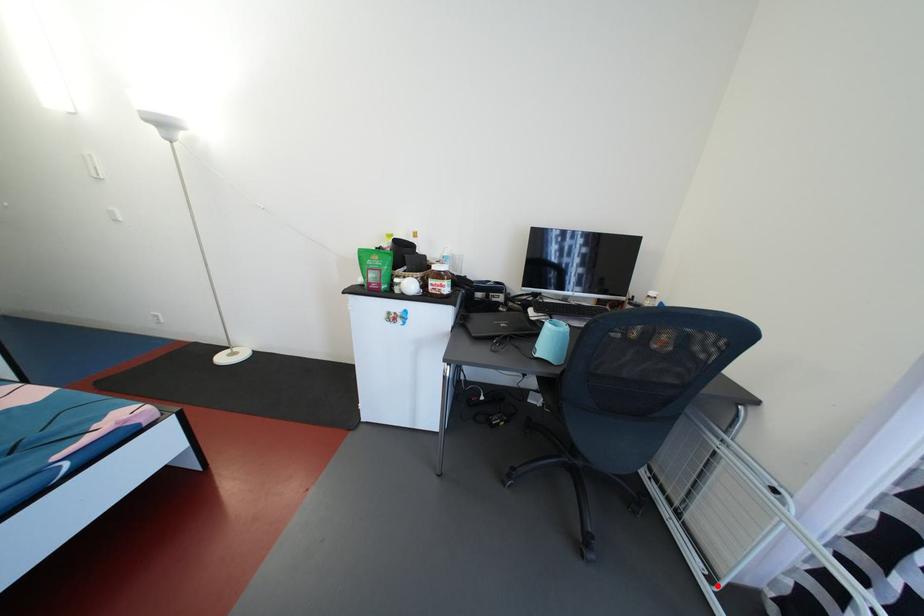
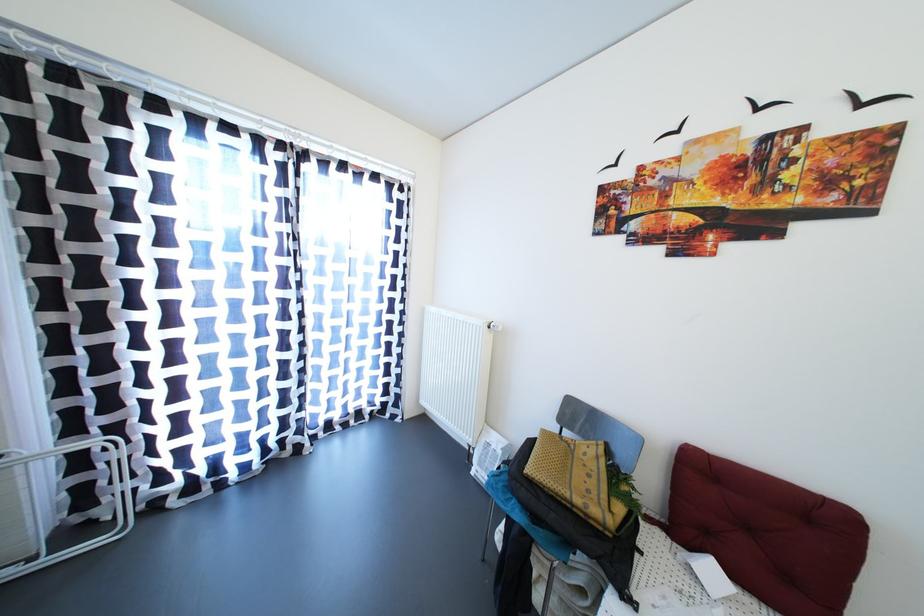
Question: I am providing you with two images of the same scene from different viewpoints. A red point is marked on the first image. Is the red point's position out of view in image 2?

Choices:
 (A) Yes
 (B) No

Answer: (B)